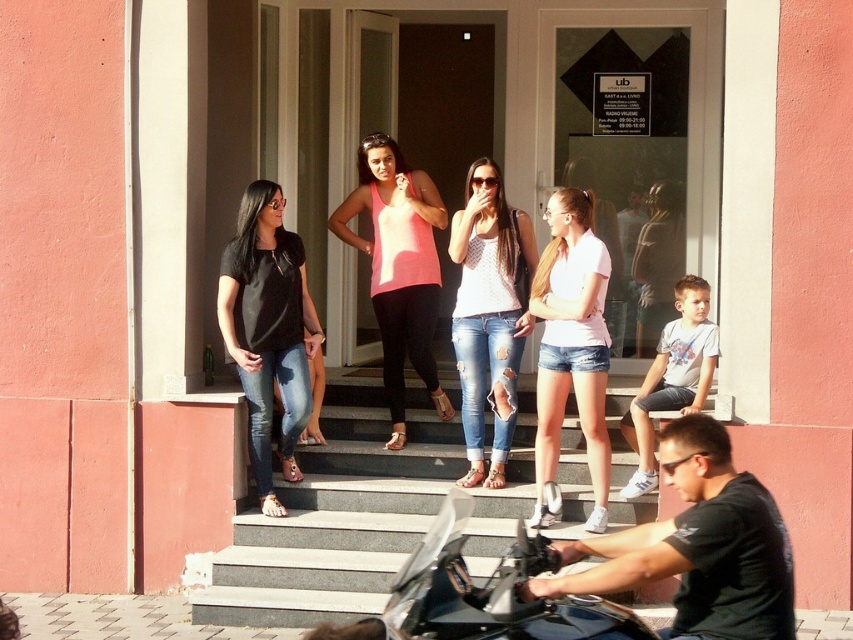
Question: Which is farther from the light blue denim shorts at lower right?

Choices:
 (A) white textured tank top at center
 (B) pink fabric tank top at center
 (C) shiny black motorcycle at center

Answer: (C)

Question: Is gray concrete stairs at center to the left of white textured tank top at center from the viewer's perspective?

Choices:
 (A) no
 (B) yes

Answer: (B)

Question: Which point is farther to the camera?

Choices:
 (A) black matte jeans at lower left
 (B) white denim shorts at center
 (C) white textured tank top at center

Answer: (C)

Question: Which of these objects is positioned farthest from the matte pink tank top at center?

Choices:
 (A) shiny black motorcycle at center
 (B) white textured tank top at center

Answer: (A)

Question: Does shiny black motorcycle at center appear over white denim shorts at center?

Choices:
 (A) yes
 (B) no

Answer: (B)

Question: Is gray concrete stairs at center thinner than matte pink tank top at center?

Choices:
 (A) no
 (B) yes

Answer: (A)